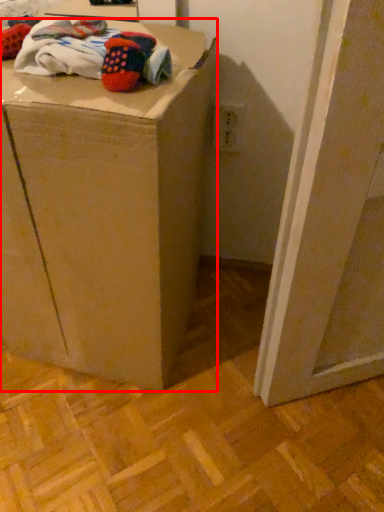
Question: In this image, where is furniture (annotated by the red box) located relative to laundry?

Choices:
 (A) right
 (B) left

Answer: (B)